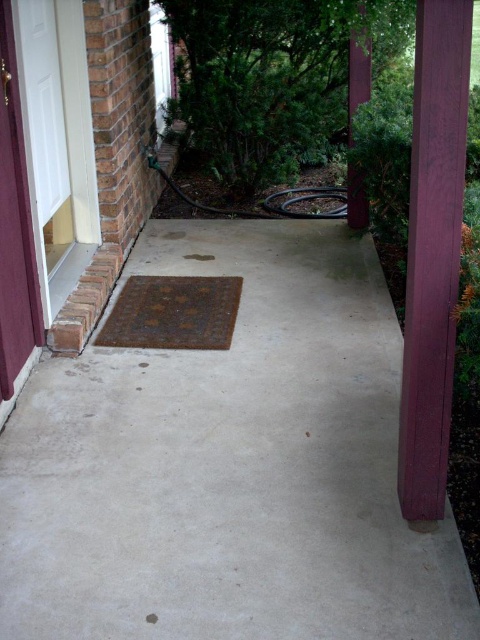
Does gray concrete at center appear on the left side of rusty metal doormat at center?

No, gray concrete at center is not to the left of rusty metal doormat at center.

Where is `gray concrete at center`? The width and height of the screenshot is (480, 640). gray concrete at center is located at coordinates (228, 465).

Can you confirm if purple wood post at right is wider than purple wood post at upper right?

Indeed, purple wood post at right has a greater width compared to purple wood post at upper right.

Does purple wood post at right have a greater height compared to purple wood post at upper right?

Indeed, purple wood post at right has a greater height compared to purple wood post at upper right.

Is point (409, 429) positioned before point (365, 60)?

Yes, point (409, 429) is in front of point (365, 60).

Locate an element on the screen. This screenshot has height=640, width=480. purple wood post at right is located at coordinates (432, 252).

Which is in front, point (429, 490) or point (205, 257)?

Positioned in front is point (429, 490).

Locate an element on the screen. purple wood post at right is located at coordinates (432, 252).

Identify the location of purple wood post at right. (432, 252).